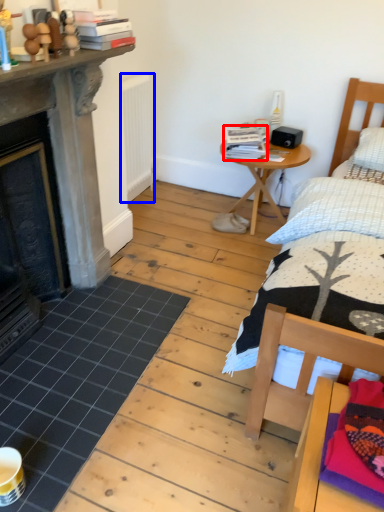
Question: Among these objects, which one is farthest to the camera, book (highlighted by a red box) or radiator (highlighted by a blue box)?

Choices:
 (A) book
 (B) radiator

Answer: (A)